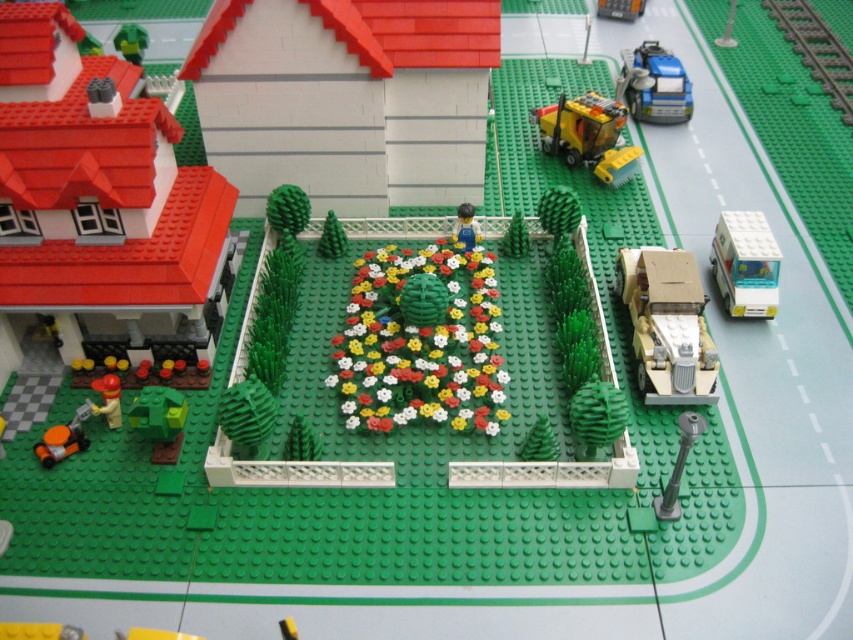
Question: Considering the real-world distances, which object is closest to the floral-patterned garden at center?

Choices:
 (A) metallic silver car at upper center
 (B) white plastic bus at right
 (C) green plastic train track at upper right
 (D) yellow plastic bulldozer at upper center

Answer: (D)

Question: Can you confirm if white plastic bus at right is bigger than green matte tree at center?

Choices:
 (A) yes
 (B) no

Answer: (A)

Question: Which object is farther from the camera taking this photo?

Choices:
 (A) blue metallic truck at upper right
 (B) tan matte truck at right
 (C) smooth plastic figure at center

Answer: (A)

Question: Does floral-patterned garden at center have a larger size compared to tan matte truck at right?

Choices:
 (A) yes
 (B) no

Answer: (A)

Question: Which object appears closest to the camera in this image?

Choices:
 (A) green plastic train track at upper right
 (B) green matte figure at upper left
 (C) smooth plastic figure at center
 (D) orange matte toy car at lower left

Answer: (D)

Question: Can you confirm if yellow plastic bulldozer at upper center is positioned to the right of orange matte toy car at lower left?

Choices:
 (A) no
 (B) yes

Answer: (B)